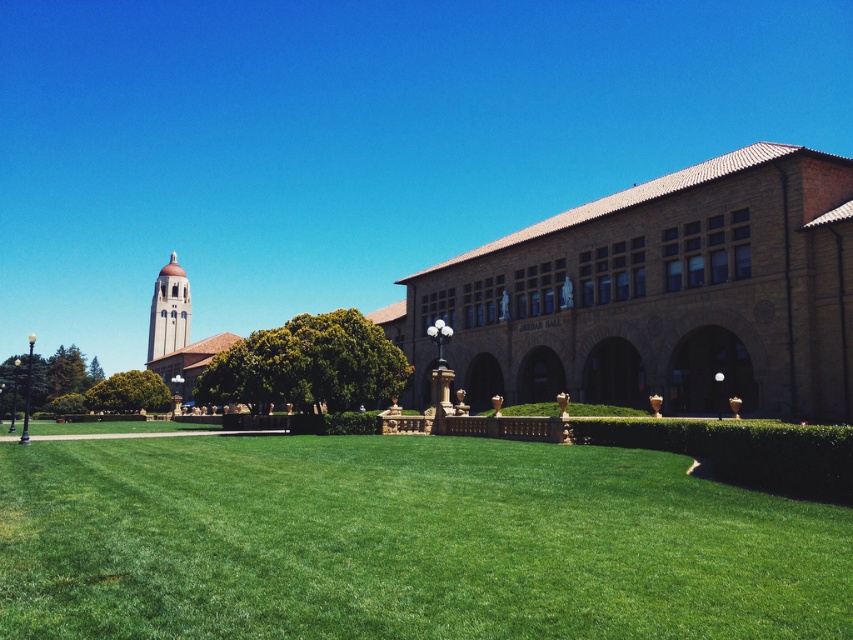
Question: Is green leafy hedge at center thinner than matte brick tower at center-left?

Choices:
 (A) no
 (B) yes

Answer: (A)

Question: Can you confirm if green grass at center is positioned above green leafy hedge at lower left?

Choices:
 (A) yes
 (B) no

Answer: (A)

Question: Which object appears farthest from the camera in this image?

Choices:
 (A) green leafy hedge at center
 (B) matte brick tower at center-left

Answer: (B)

Question: Estimate the real-world distances between objects in this image. Which object is closer to the green leafy hedge at lower left?

Choices:
 (A) green leafy hedge at center
 (B) green grass at center
 (C) matte brick tower at center-left

Answer: (A)

Question: Which of these objects is positioned farthest from the matte brick tower at center-left?

Choices:
 (A) green leafy hedge at center
 (B) green leafy hedge at lower left
 (C) green grass at center

Answer: (C)

Question: Can you confirm if green grass at center is bigger than green leafy hedge at center?

Choices:
 (A) yes
 (B) no

Answer: (B)